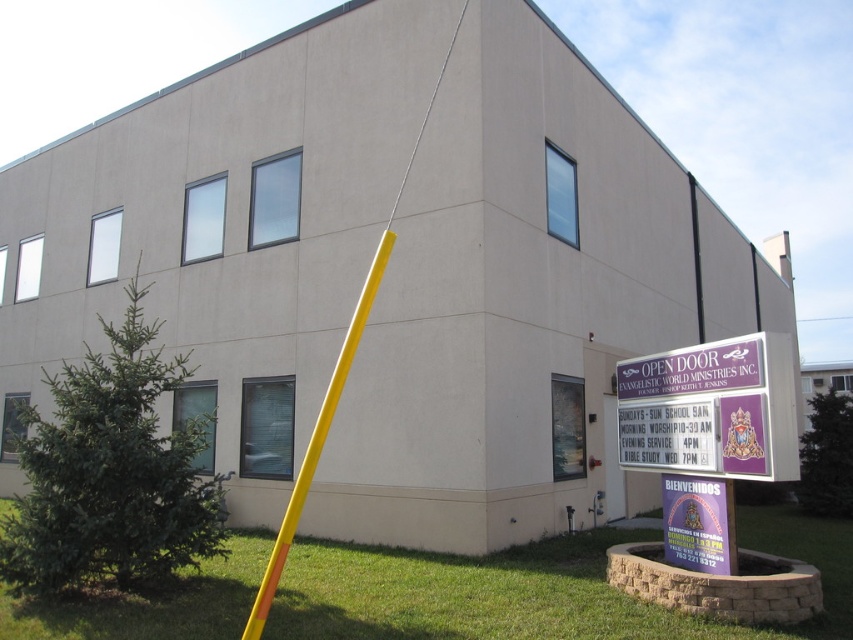
How far apart are purple matte sign at lower right and purple paper sign at lower right?

The distance of purple matte sign at lower right from purple paper sign at lower right is 97.54 centimeters.

Is purple matte sign at lower right taller than purple paper sign at lower right?

Incorrect, purple matte sign at lower right's height is not larger of purple paper sign at lower right's.

Between point (759, 365) and point (691, 490), which one is positioned in front?

Point (759, 365)

Identify the location of purple matte sign at lower right. (694, 369).

Between point (637, 369) and point (274, 554), which one is positioned behind?

Positioned behind is point (637, 369).

Who is positioned more to the right, purple matte sign at lower right or yellow plastic pole at center?

Positioned to the right is purple matte sign at lower right.

Find the location of a particular element. This screenshot has height=640, width=853. purple matte sign at lower right is located at coordinates (694, 369).

The image size is (853, 640). I want to click on purple matte sign at lower right, so click(694, 369).

Between yellow plastic pole at center and purple paper sign at lower right, which one appears on the left side from the viewer's perspective?

yellow plastic pole at center

Is yellow plastic pole at center shorter than purple paper sign at lower right?

Indeed, yellow plastic pole at center has a lesser height compared to purple paper sign at lower right.

Between point (270, 566) and point (706, 572), which one is positioned in front?

Point (270, 566) is more forward.

This screenshot has height=640, width=853. I want to click on yellow plastic pole at center, so click(317, 440).